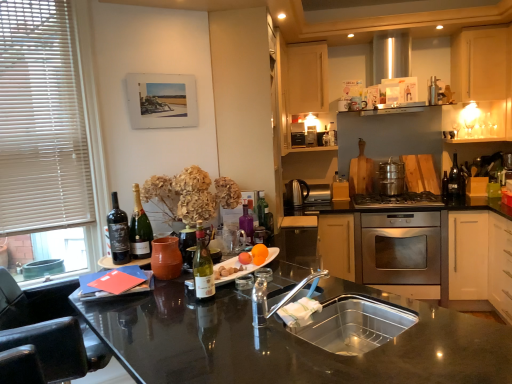
You are a GUI agent. You are given a task and a screenshot of the screen. Output one action in this format:
    pyautogui.click(x=<x>, y=<y>)
    Task: Click on the free space above black glossy countertop at center (from a real-world perspective)
    
    Given the screenshot: What is the action you would take?
    pyautogui.click(x=313, y=350)